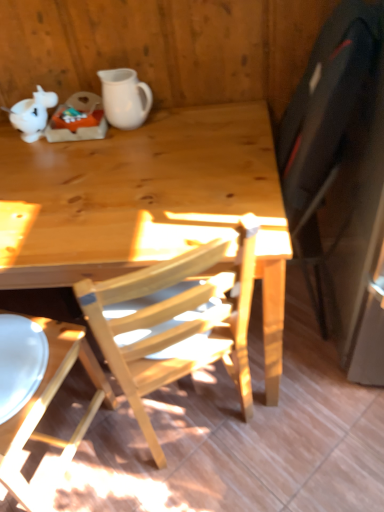
Question: Can we say wooden chair at lower left lies outside white matte pitcher at upper left?

Choices:
 (A) no
 (B) yes

Answer: (B)

Question: Considering the relative positions of wooden chair at lower left and white matte pitcher at upper left in the image provided, is wooden chair at lower left to the left of white matte pitcher at upper left from the viewer's perspective?

Choices:
 (A) no
 (B) yes

Answer: (B)

Question: Can you confirm if wooden chair at lower left is taller than white matte pitcher at upper left?

Choices:
 (A) no
 (B) yes

Answer: (B)

Question: Considering the relative positions of wooden chair at lower left and white matte pitcher at upper left in the image provided, is wooden chair at lower left to the right of white matte pitcher at upper left from the viewer's perspective?

Choices:
 (A) no
 (B) yes

Answer: (A)

Question: Is wooden chair at lower left further to camera compared to white matte pitcher at upper left?

Choices:
 (A) yes
 (B) no

Answer: (B)

Question: Is wooden chair at lower left not close to white matte pitcher at upper left?

Choices:
 (A) yes
 (B) no

Answer: (B)

Question: From a real-world perspective, is white matte pitcher at upper left on white matte teapot at upper left?

Choices:
 (A) yes
 (B) no

Answer: (A)

Question: From a real-world perspective, is white matte pitcher at upper left located beneath white matte teapot at upper left?

Choices:
 (A) yes
 (B) no

Answer: (B)

Question: From the image's perspective, is white matte pitcher at upper left above white matte teapot at upper left?

Choices:
 (A) no
 (B) yes

Answer: (B)

Question: Can you confirm if white matte pitcher at upper left is taller than white matte teapot at upper left?

Choices:
 (A) no
 (B) yes

Answer: (B)

Question: Considering the relative sizes of white matte pitcher at upper left and white matte teapot at upper left in the image provided, is white matte pitcher at upper left shorter than white matte teapot at upper left?

Choices:
 (A) yes
 (B) no

Answer: (B)

Question: Considering the relative positions of white matte pitcher at upper left and white matte teapot at upper left in the image provided, is white matte pitcher at upper left to the left of white matte teapot at upper left from the viewer's perspective?

Choices:
 (A) yes
 (B) no

Answer: (B)

Question: Considering the relative positions of wooden chair at lower left and natural wood desk at center in the image provided, is wooden chair at lower left to the left of natural wood desk at center from the viewer's perspective?

Choices:
 (A) no
 (B) yes

Answer: (B)